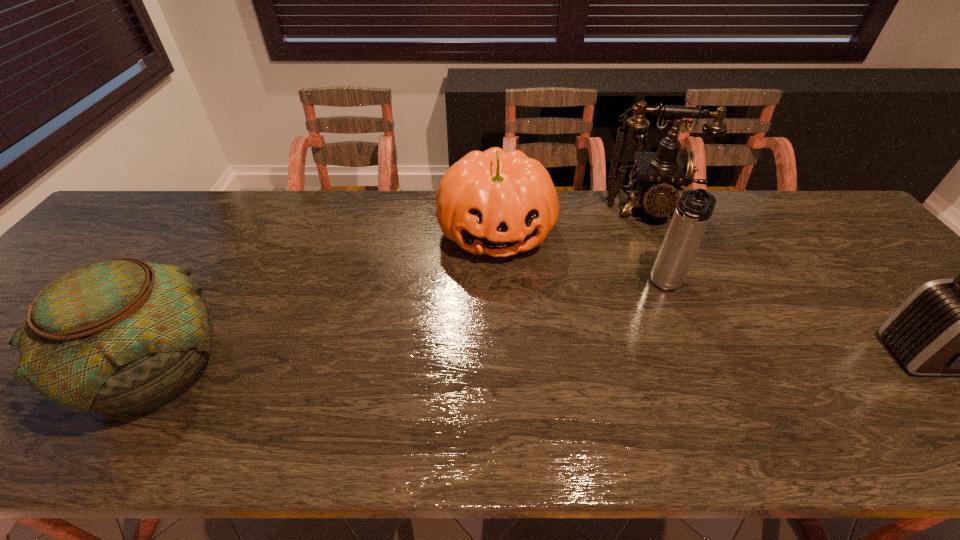
What are the coordinates of `vacant space located 0.190m on the handle side of the thermos bottle` in the screenshot? It's located at (638, 353).

I want to click on free spot located on the rotary dial of the tallest object, so click(x=652, y=248).

Identify the location of free space located on the rotary dial of the tallest object. Image resolution: width=960 pixels, height=540 pixels. (662, 307).

In order to click on vacant space situated 0.390m on the rotary dial of the tallest object in this screenshot , I will do `click(667, 332)`.

The width and height of the screenshot is (960, 540). Identify the location of pumpkin that is positioned at the far edge. (499, 203).

Find the location of a particular element. telephone that is at the far edge is located at coordinates (660, 175).

Locate an element on the screen. object at the near edge is located at coordinates [120, 335].

Find the location of a particular element. The height and width of the screenshot is (540, 960). vacant space at the far edge is located at coordinates (745, 207).

Image resolution: width=960 pixels, height=540 pixels. Identify the location of vacant space at the near edge of the desktop. (686, 404).

At what (x,y) coordinates should I click in order to perform the action: click on free space at the right edge of the desktop. Please return your answer as a coordinate pair (x, y). Looking at the image, I should click on (858, 255).